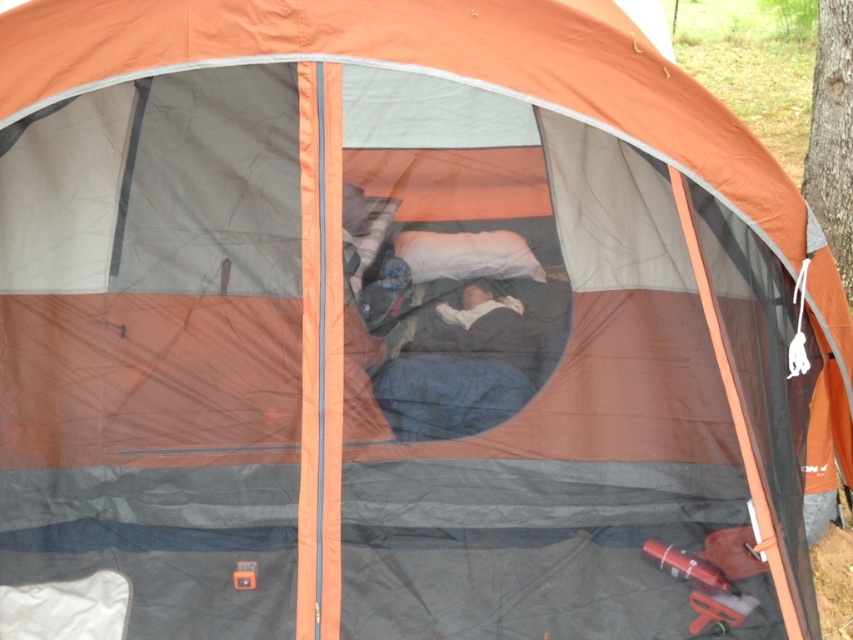
Can you confirm if dark blue sleeping bag at center is shorter than white soft pillow at center?

No.

Does point (440, 374) come farther from viewer compared to point (457, 250)?

No.

Does point (372, 376) lie in front of point (433, 268)?

Yes, it is in front of point (433, 268).

The image size is (853, 640). Identify the location of dark blue sleeping bag at center. (461, 371).